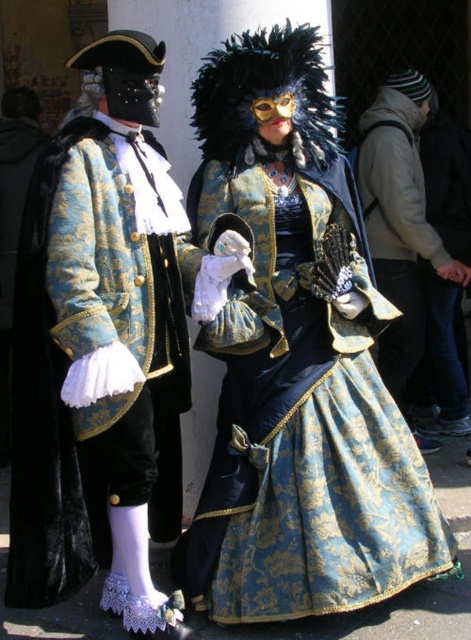
Who is positioned more to the left, gold brocade dress at center or matte black coat at center?

Positioned to the left is gold brocade dress at center.

Between gold brocade dress at center and matte black coat at center, which one is positioned lower?

gold brocade dress at center is lower down.

Is point (334, 397) closer to camera compared to point (390, 193)?

Yes.

Locate an element on the screen. The height and width of the screenshot is (640, 471). gold brocade dress at center is located at coordinates (302, 424).